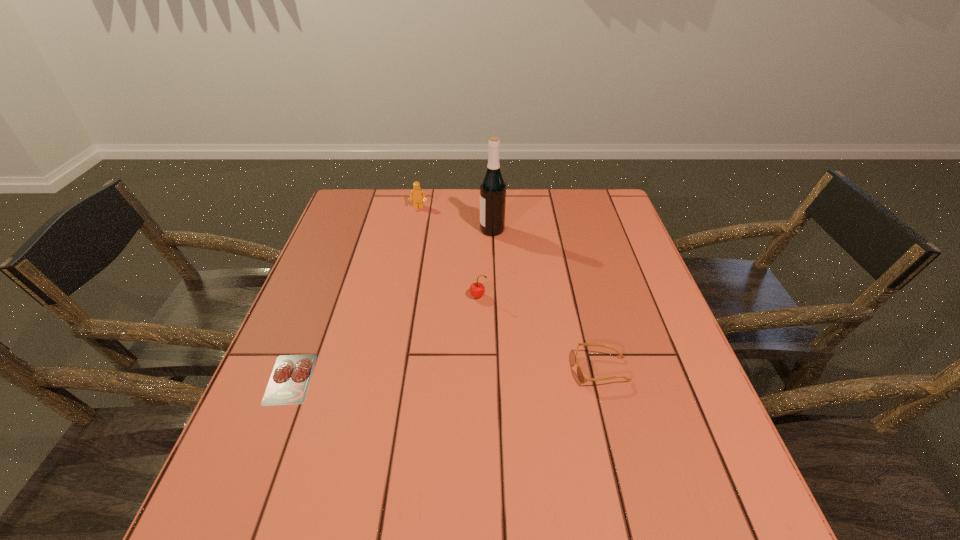
Locate an element on the screen. free location located 0.390m on the label of the tallest object is located at coordinates (353, 230).

This screenshot has width=960, height=540. Identify the location of blank space located 0.050m on the label of the tallest object. (464, 230).

Find the location of a particular element. The width and height of the screenshot is (960, 540). free space located 0.190m on the face of the farthest object is located at coordinates (411, 245).

Locate an element on the screen. Image resolution: width=960 pixels, height=540 pixels. vacant space located on the left of the cherry is located at coordinates [x=439, y=296].

Image resolution: width=960 pixels, height=540 pixels. I want to click on vacant area situated 0.150m on the front-facing side of the fourth tallest object, so click(x=507, y=370).

Identify the location of free space located on the front-facing side of the fourth tallest object. (507, 370).

Identify the location of vacant area situated 0.220m on the front-facing side of the fourth tallest object. This screenshot has width=960, height=540. (474, 370).

The height and width of the screenshot is (540, 960). I want to click on free point located on the back of the shortest object, so click(x=328, y=281).

This screenshot has height=540, width=960. Identify the location of wine bottle that is at the far edge. (493, 187).

I want to click on Lego that is at the far edge, so click(x=417, y=194).